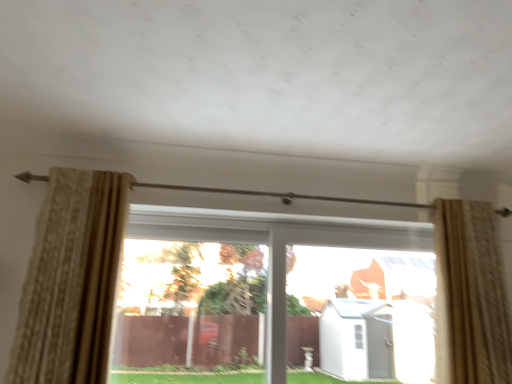
Question: Is the depth of transparent glass window at center, which is the 2th window from right to left, less than that of beige textured curtain at right, the 2th curtain when ordered from left to right?

Choices:
 (A) yes
 (B) no

Answer: (B)

Question: Considering the relative sizes of transparent glass window at center, which is the 2th window from right to left, and beige textured curtain at right, the 2th curtain when ordered from left to right, in the image provided, is transparent glass window at center, which is the 2th window from right to left, bigger than beige textured curtain at right, the 2th curtain when ordered from left to right,?

Choices:
 (A) yes
 (B) no

Answer: (B)

Question: Considering the relative positions of transparent glass window at center, the 1th window positioned from the left, and beige textured curtain at right, the 2th curtain when ordered from left to right, in the image provided, is transparent glass window at center, the 1th window positioned from the left, to the left of beige textured curtain at right, the 2th curtain when ordered from left to right, from the viewer's perspective?

Choices:
 (A) no
 (B) yes

Answer: (B)

Question: Is transparent glass window at center, the 1th window positioned from the left, in contact with beige textured curtain at right, the 1th curtain in the right-to-left sequence?

Choices:
 (A) yes
 (B) no

Answer: (B)

Question: Does transparent glass window at center, the 1th window positioned from the left, appear on the right side of beige textured curtain at right, the 2th curtain when ordered from left to right?

Choices:
 (A) no
 (B) yes

Answer: (A)

Question: Is beige textured curtain at left, the second curtain viewed from the right, inside or outside of beige textured curtain at right, the 1th curtain in the right-to-left sequence?

Choices:
 (A) inside
 (B) outside

Answer: (B)

Question: In the image, is beige textured curtain at left, the second curtain viewed from the right, positioned in front of or behind beige textured curtain at right, the 1th curtain in the right-to-left sequence?

Choices:
 (A) behind
 (B) front

Answer: (B)

Question: From a real-world perspective, is beige textured curtain at left, the first curtain viewed from the left, positioned above or below beige textured curtain at right, the 2th curtain when ordered from left to right?

Choices:
 (A) above
 (B) below

Answer: (A)

Question: Based on their positions, is beige textured curtain at left, the first curtain viewed from the left, located to the left or right of beige textured curtain at right, the 1th curtain in the right-to-left sequence?

Choices:
 (A) left
 (B) right

Answer: (A)

Question: Is transparent glass window at center, the 1th window positioned from the left, inside or outside of beige textured curtain at right, the 1th curtain in the right-to-left sequence?

Choices:
 (A) outside
 (B) inside

Answer: (A)

Question: From a real-world perspective, is transparent glass window at center, the 1th window positioned from the left, physically located above or below beige textured curtain at right, the 2th curtain when ordered from left to right?

Choices:
 (A) above
 (B) below

Answer: (B)

Question: From the image's perspective, is transparent glass window at center, the 1th window positioned from the left, above or below beige textured curtain at right, the 1th curtain in the right-to-left sequence?

Choices:
 (A) above
 (B) below

Answer: (B)

Question: Looking at their shapes, would you say transparent glass window at center, which is the 2th window from right to left, is wider or thinner than beige textured curtain at right, the 1th curtain in the right-to-left sequence?

Choices:
 (A) thin
 (B) wide

Answer: (A)

Question: Is beige textured curtain at left, the first curtain viewed from the left, taller or shorter than transparent glass window at center, the first window when ordered from right to left?

Choices:
 (A) tall
 (B) short

Answer: (A)

Question: Is beige textured curtain at left, the first curtain viewed from the left, bigger or smaller than transparent glass window at center, the 2th window in the left-to-right sequence?

Choices:
 (A) big
 (B) small

Answer: (A)